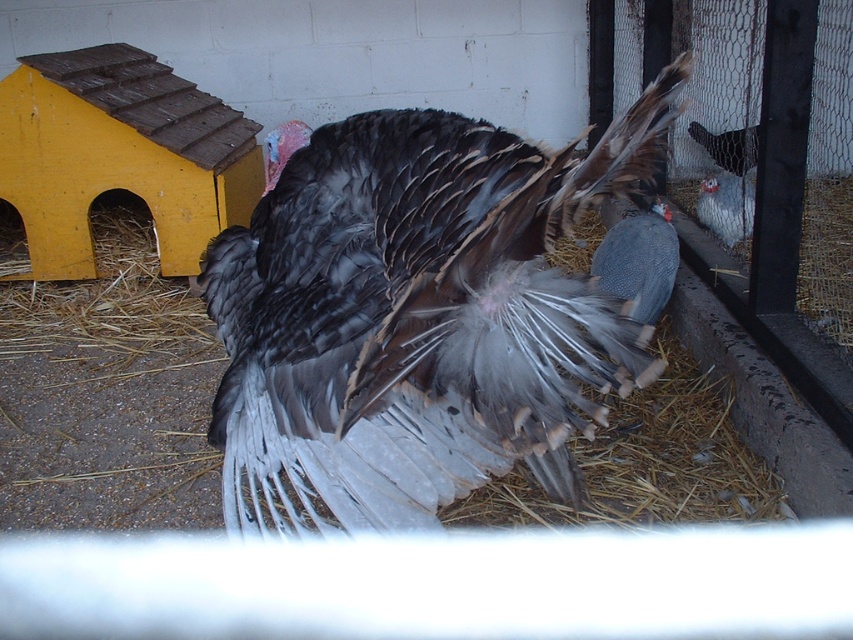
Who is positioned more to the right, gray speckled feathered bird at right or gray matte turkey at center?

gray matte turkey at center

Is point (709, 205) in front of point (733, 132)?

Yes, point (709, 205) is closer to viewer.

Find the location of `gray speckled feathered bird at right`. gray speckled feathered bird at right is located at coordinates [x=727, y=204].

Which is above, gray feathered turkey at center or gray matte turkey at center?

gray matte turkey at center is higher up.

Does point (408, 250) lie in front of point (740, 131)?

Yes.

Is point (546, 236) in front of point (743, 141)?

Yes, it is in front of point (743, 141).

The width and height of the screenshot is (853, 640). Find the location of `gray feathered turkey at center`. gray feathered turkey at center is located at coordinates (416, 317).

Between gray feathered turkey at center and gray speckled feathered bird at right, which one is positioned lower?

gray feathered turkey at center is below.

Is point (677, 74) closer to viewer compared to point (708, 204)?

Yes.

This screenshot has height=640, width=853. What do you see at coordinates (416, 317) in the screenshot?
I see `gray feathered turkey at center` at bounding box center [416, 317].

The image size is (853, 640). Identify the location of gray feathered turkey at center. (416, 317).